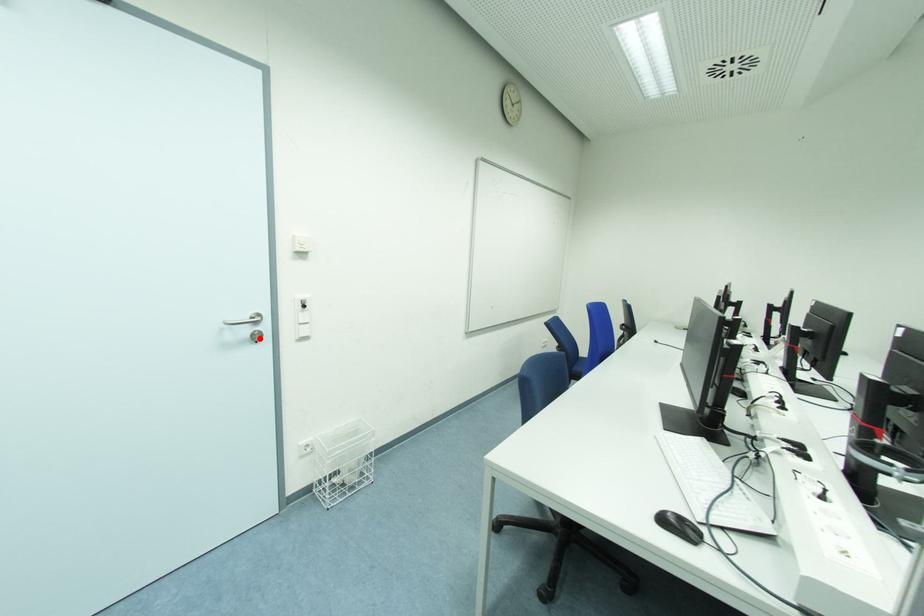
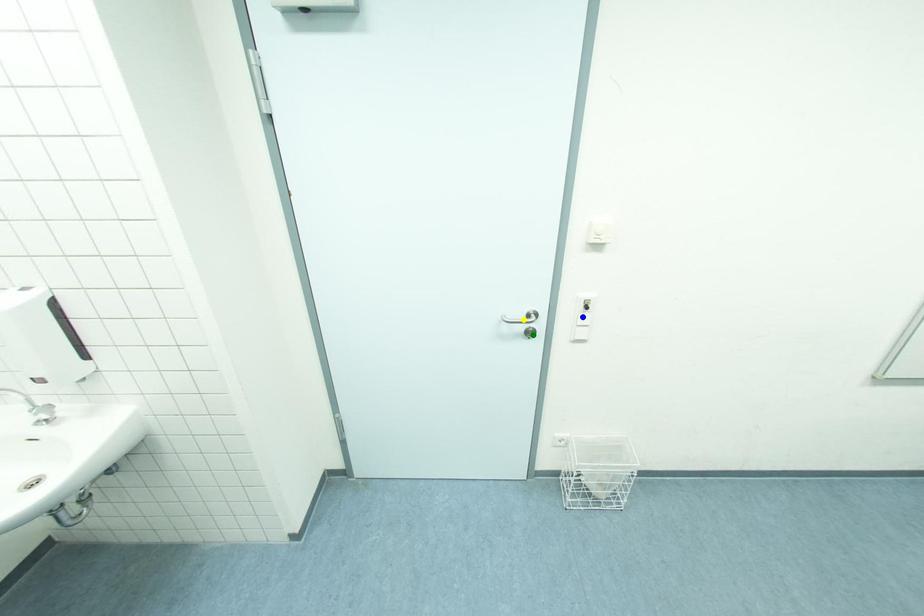
Question: I am providing you with two images of the same scene from different viewpoints. A red point is marked on the first image. You are given multiple points on the second image. Which mark in image 2 goes with the point in image 1?

Choices:
 (A) yellow point
 (B) blue point
 (C) green point

Answer: (C)